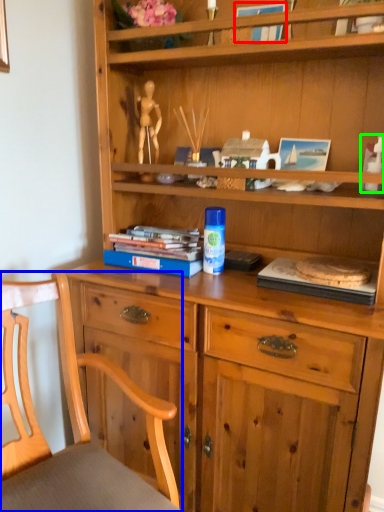
Question: Which is farther away from book (highlighted by a red box)? chair (highlighted by a blue box) or toy (highlighted by a green box)?

Choices:
 (A) chair
 (B) toy

Answer: (A)